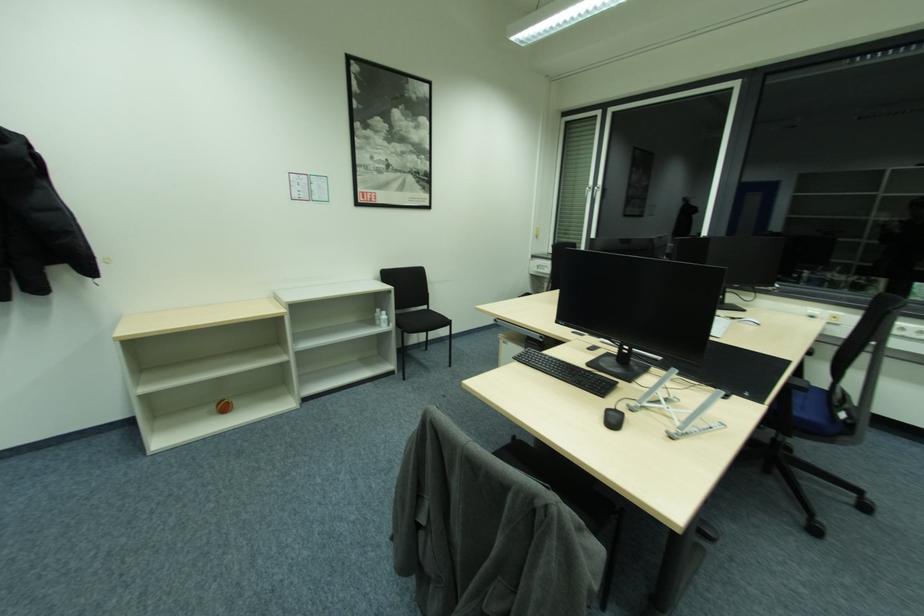
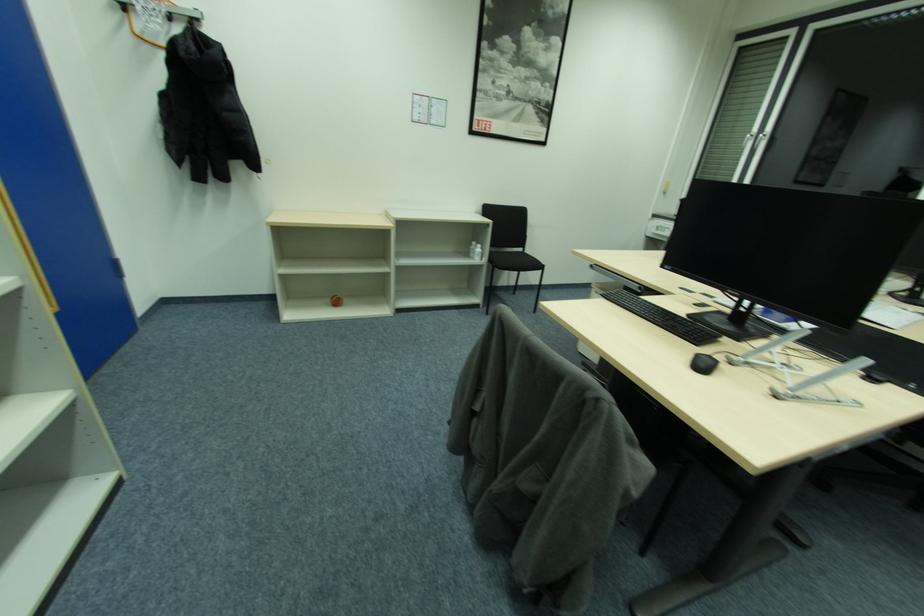
Question: How did the camera likely rotate?

Choices:
 (A) Left
 (B) Right
 (C) Up
 (D) Down

Answer: (A)